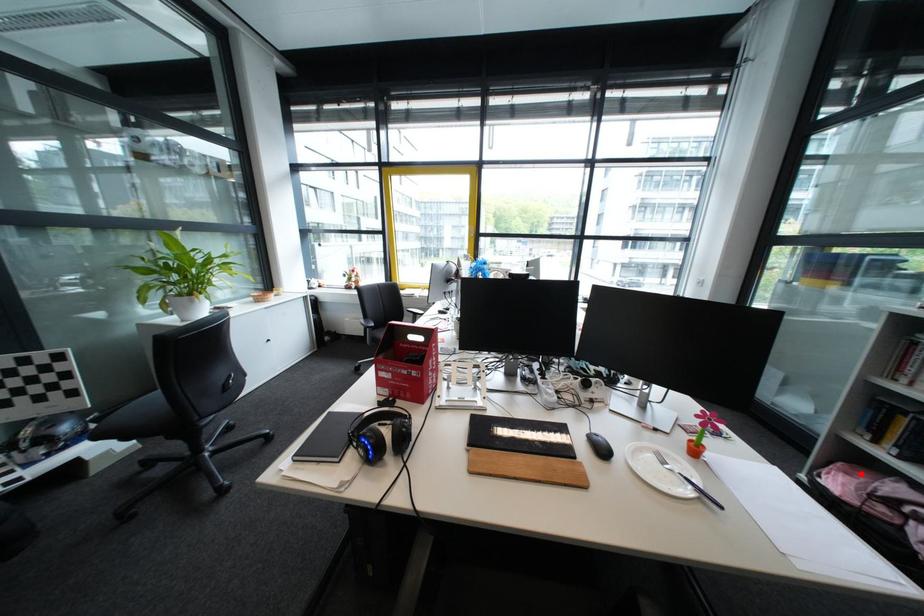
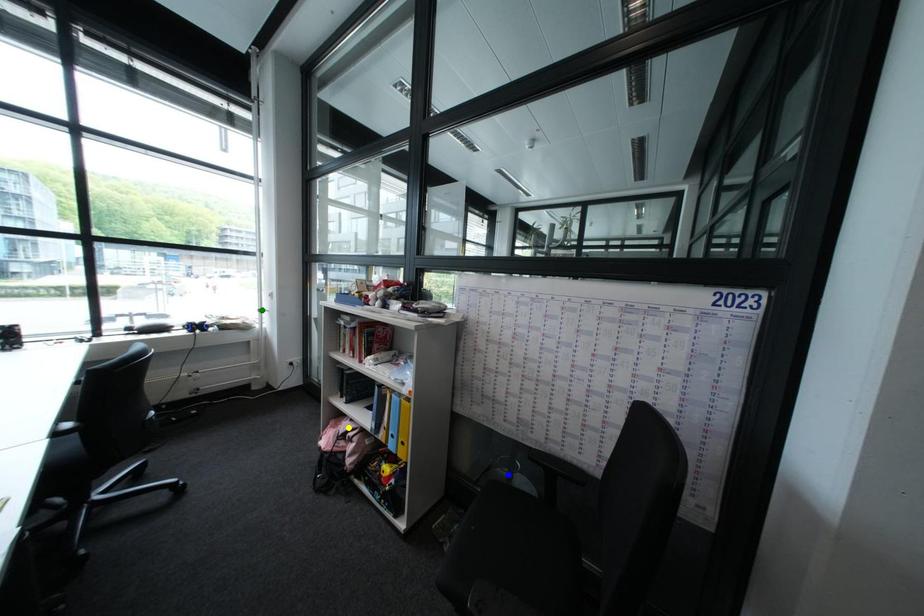
Question: I am providing you with two images of the same scene from different viewpoints. A red point is marked on the first image. You are given multiple points on the second image. Which point in image 2 is actually the same real-world point as the red point in image 1?

Choices:
 (A) yellow point
 (B) blue point
 (C) green point

Answer: (A)